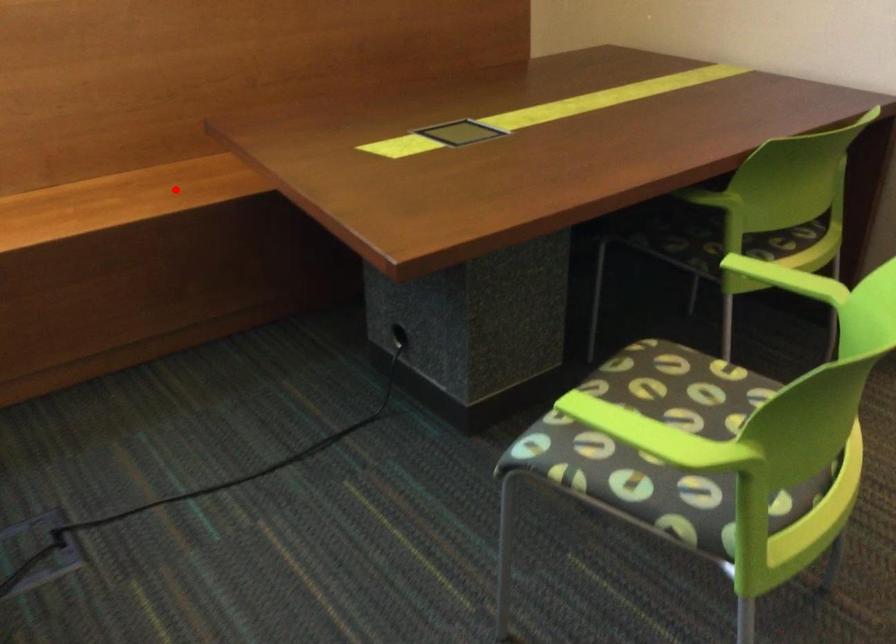
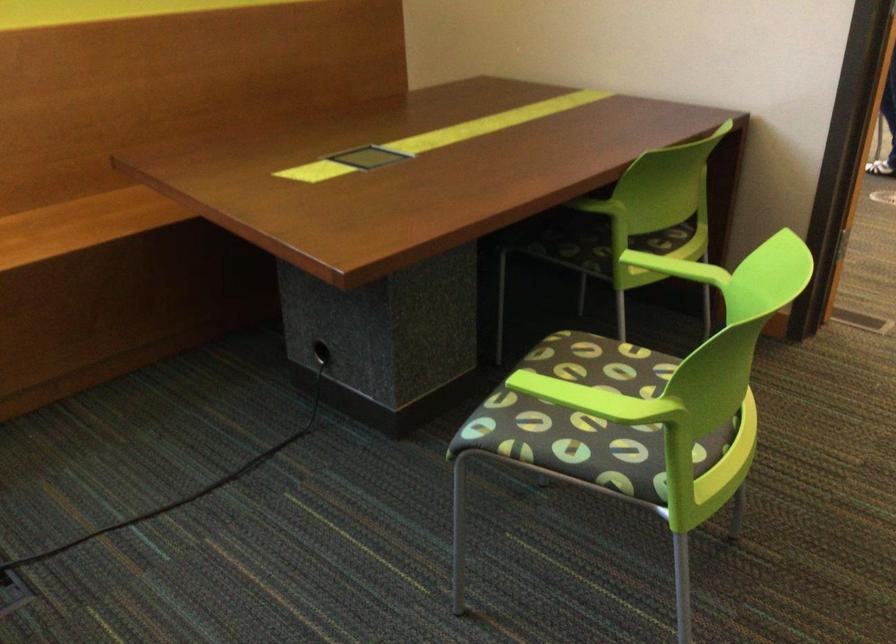
In the second image, find the point that corresponds to the highlighted location in the first image.

(80, 223)